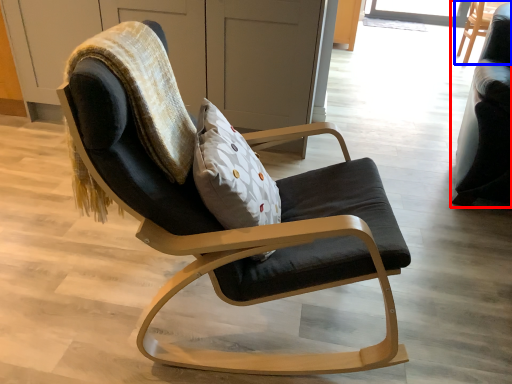
Question: Which object appears farthest to the camera in this image, chair (highlighted by a red box) or chair (highlighted by a blue box)?

Choices:
 (A) chair
 (B) chair

Answer: (B)